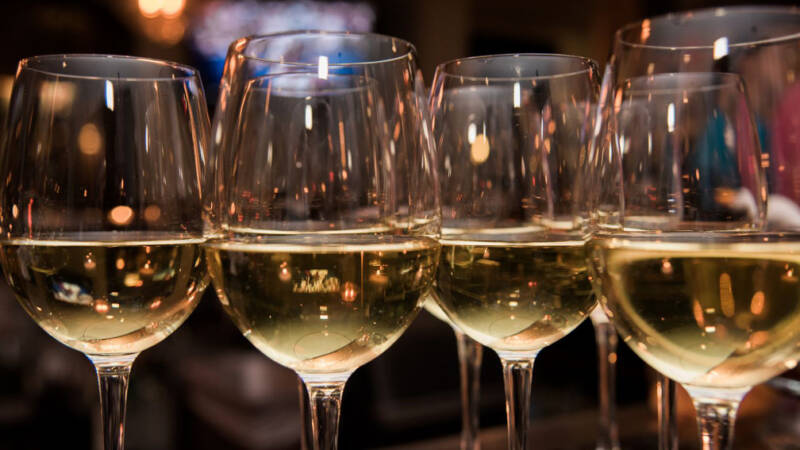
Where is `rim of wine glass`? Image resolution: width=800 pixels, height=450 pixels. rim of wine glass is located at coordinates (113, 66), (334, 35), (524, 51), (713, 13).